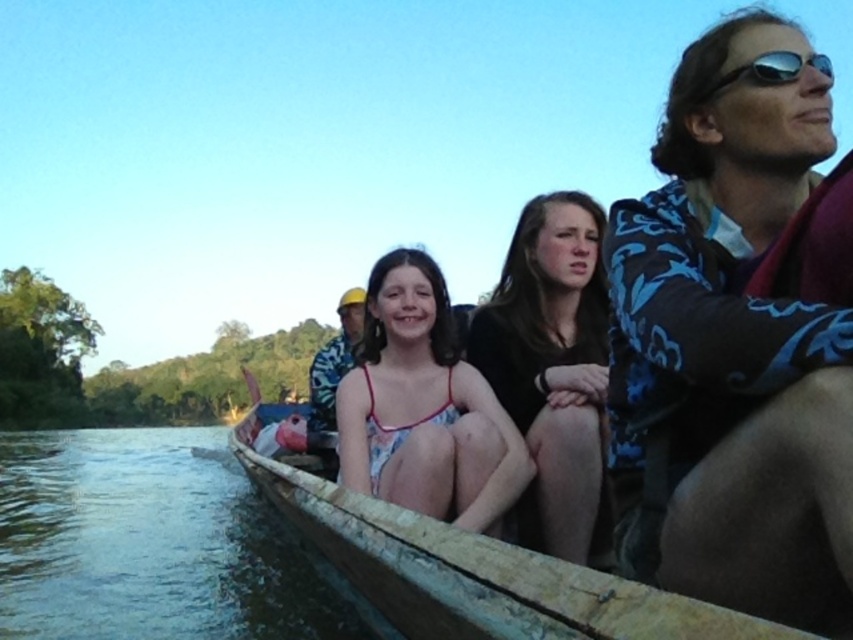
How much distance is there between dark brown fabric at center and sunglasses at upper right?

dark brown fabric at center is 2.85 meters from sunglasses at upper right.

Can you confirm if dark brown fabric at center is thinner than sunglasses at upper right?

No, dark brown fabric at center is not thinner than sunglasses at upper right.

Is point (602, 419) positioned behind point (793, 68)?

Yes, it is behind point (793, 68).

Image resolution: width=853 pixels, height=640 pixels. Identify the location of dark brown fabric at center. (552, 362).

Who is more forward, (312, 410) or (779, 77)?

Point (779, 77) is more forward.

Is blue floral shirt at center closer to the viewer compared to sunglasses at upper right?

No.

You are a GUI agent. You are given a task and a screenshot of the screen. Output one action in this format:
    pyautogui.click(x=<x>, y=<y>)
    Task: Click on the blue floral shirt at center
    This screenshot has height=640, width=853.
    Given the screenshot: What is the action you would take?
    pyautogui.click(x=335, y=360)

The height and width of the screenshot is (640, 853). What are the coordinates of `blue floral shirt at center` in the screenshot? It's located at (335, 360).

Is point (375, 554) closer to camera compared to point (519, 384)?

Yes.

The image size is (853, 640). Describe the element at coordinates (473, 570) in the screenshot. I see `wooden canoe at center` at that location.

At what (x,y) coordinates should I click in order to perform the action: click on wooden canoe at center. Please return your answer as a coordinate pair (x, y). The height and width of the screenshot is (640, 853). Looking at the image, I should click on (473, 570).